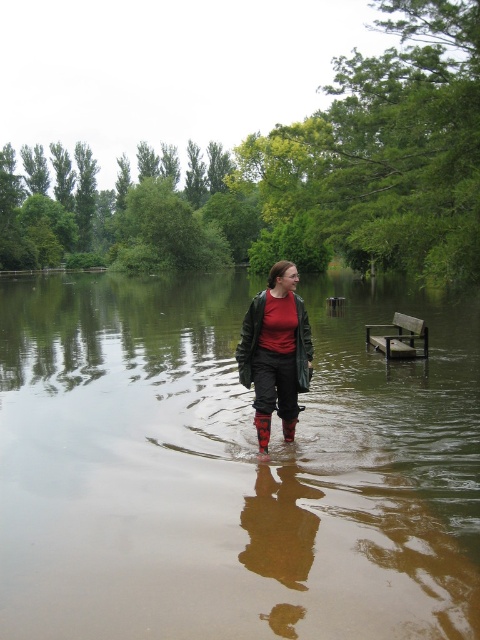
From the picture: You are trying to decide which rain boot to step into first. You see the red rubber rain boot at center and the rubber matte rain boot at center. Which one is located to the left?

The red rubber rain boot at center is positioned on the left side of rubber matte rain boot at center, so it is located to the left.

You are a photographer trying to capture the reflection of the person in the water. Since the brown matte water at center and the rubber matte rain boot at center are both in the frame, which object should you focus on to ensure the reflection is clearly visible?

The brown matte water at center is positioned on the left side of the rubber matte rain boot at center. To capture the reflection, focus on the brown matte water at center as it is the reflective surface.

You are trying to cross the flooded area shown in the image. You see the brown matte water at center and the rubber matte rain boot at center. Which object is closer to you as you approach the flooded area?

The brown matte water at center is closer to you because it is in front of the rubber matte rain boot at center.